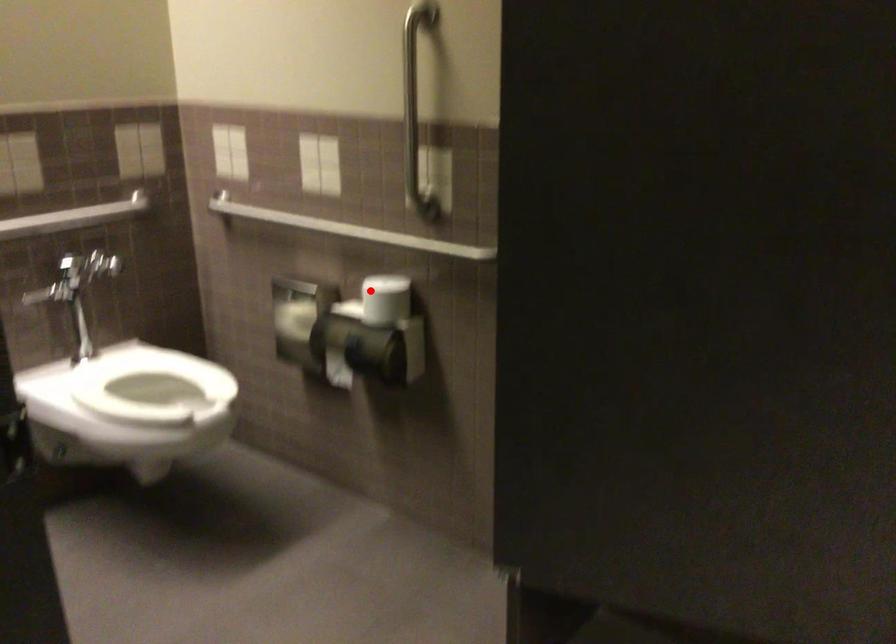
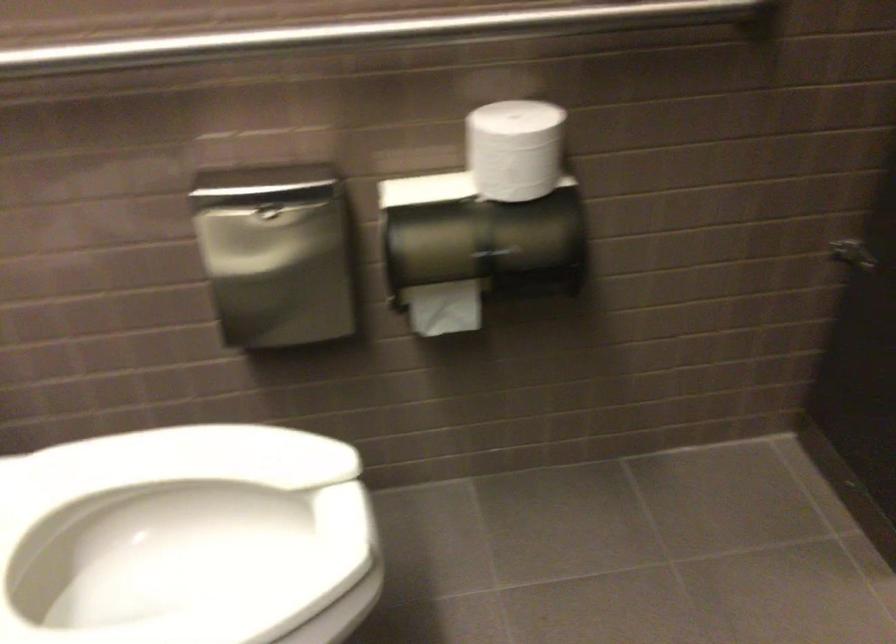
In the second image, find the point that corresponds to the highlighted location in the first image.

(514, 149)